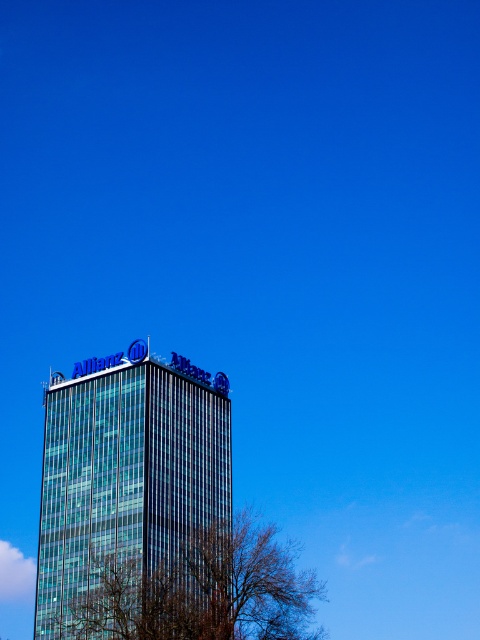
Question: Does transparent glass building at center have a larger size compared to bare branches at lower center?

Choices:
 (A) yes
 (B) no

Answer: (B)

Question: Which object is closer to the camera taking this photo?

Choices:
 (A) transparent glass building at center
 (B) bare branches at lower center

Answer: (B)

Question: Which point is closer to the camera?

Choices:
 (A) transparent glass building at center
 (B) bare branches at lower center

Answer: (B)

Question: Does transparent glass building at center have a larger size compared to bare branches at lower center?

Choices:
 (A) yes
 (B) no

Answer: (B)

Question: Is transparent glass building at center further to the viewer compared to bare branches at lower center?

Choices:
 (A) no
 (B) yes

Answer: (B)